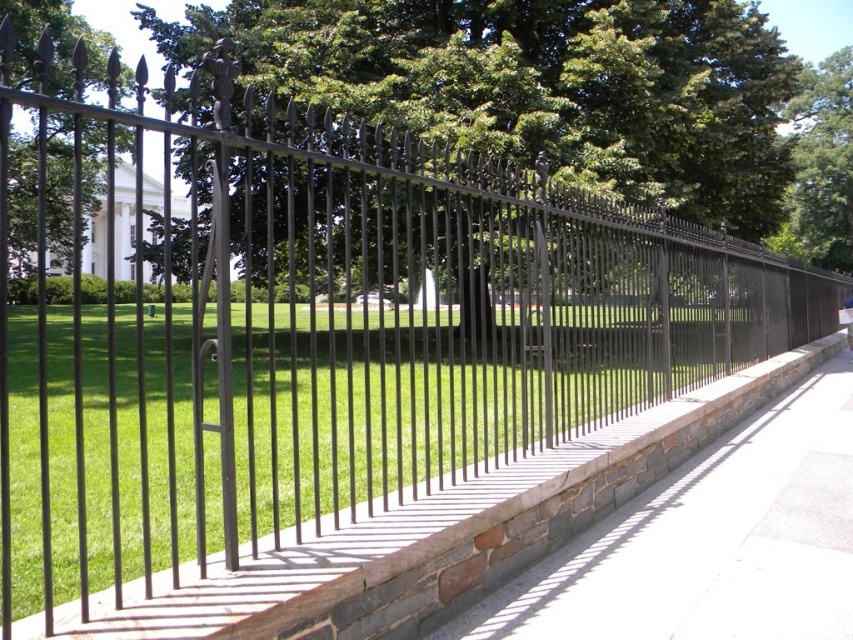
Question: Which point is farther to the camera?

Choices:
 (A) green leafy tree at upper right
 (B) green leafy tree at center
 (C) gray concrete pavement at center

Answer: (A)

Question: Is gray concrete pavement at center above green leafy tree at upper right?

Choices:
 (A) no
 (B) yes

Answer: (A)

Question: Which point is closer to the camera?

Choices:
 (A) gray concrete pavement at center
 (B) green leafy tree at center

Answer: (A)

Question: Is gray concrete pavement at center below green leafy tree at upper right?

Choices:
 (A) yes
 (B) no

Answer: (A)

Question: Can you confirm if green leafy tree at center is smaller than gray concrete pavement at center?

Choices:
 (A) no
 (B) yes

Answer: (A)

Question: Estimate the real-world distances between objects in this image. Which object is closer to the gray concrete pavement at center?

Choices:
 (A) green leafy tree at center
 (B) green leafy tree at upper right

Answer: (A)